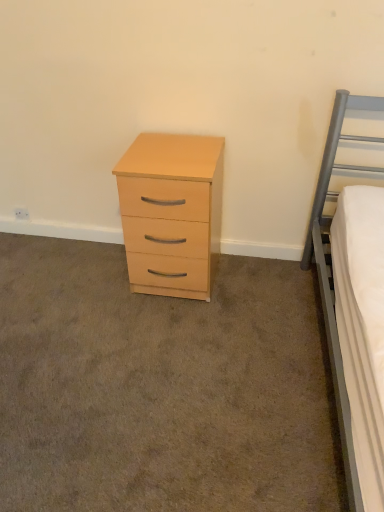
You are a GUI agent. You are given a task and a screenshot of the screen. Output one action in this format:
    pyautogui.click(x=<x>, y=<y>)
    Task: Click on the free spot above light wood/veneer chest of drawers at center (from a real-world perspective)
    
    Given the screenshot: What is the action you would take?
    pyautogui.click(x=173, y=149)